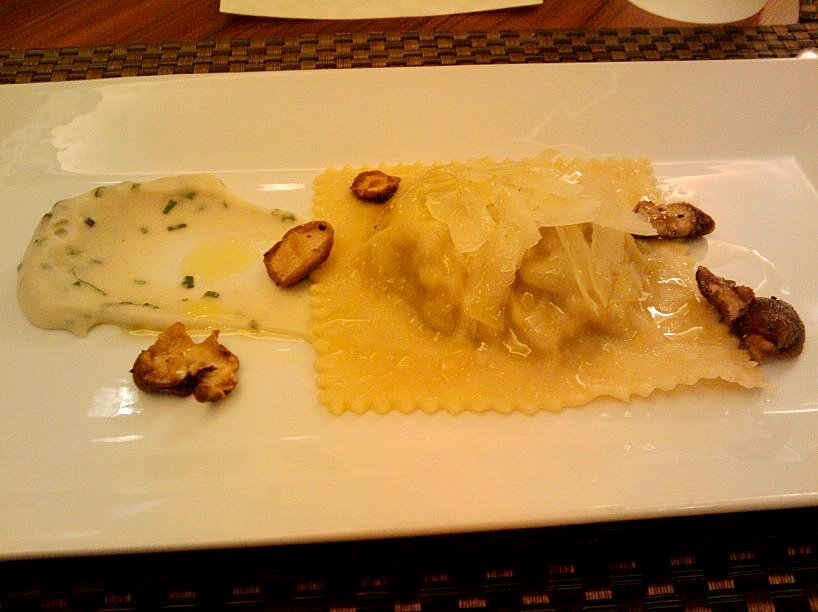
Where is `white circular cup or container, looks to be paper`? white circular cup or container, looks to be paper is located at coordinates (703, 12).